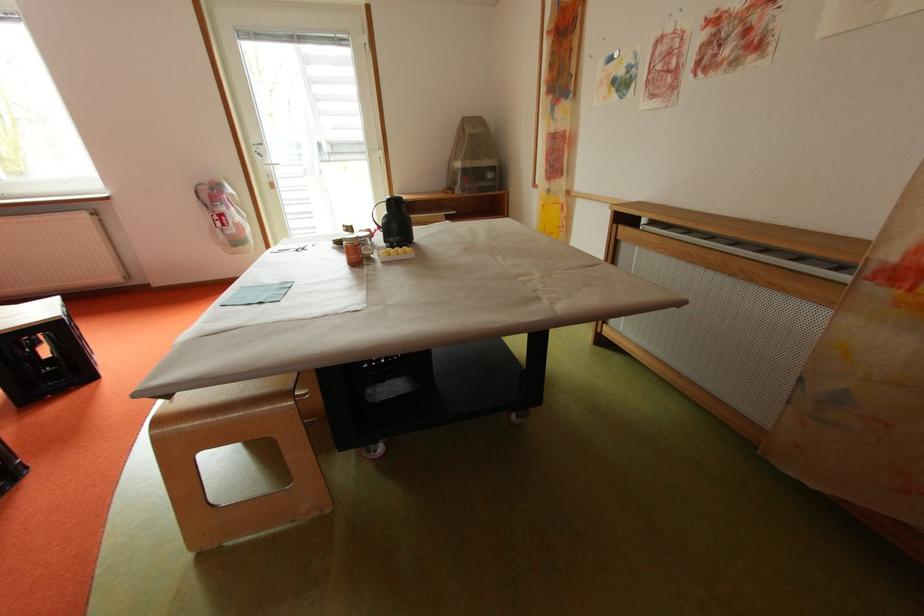
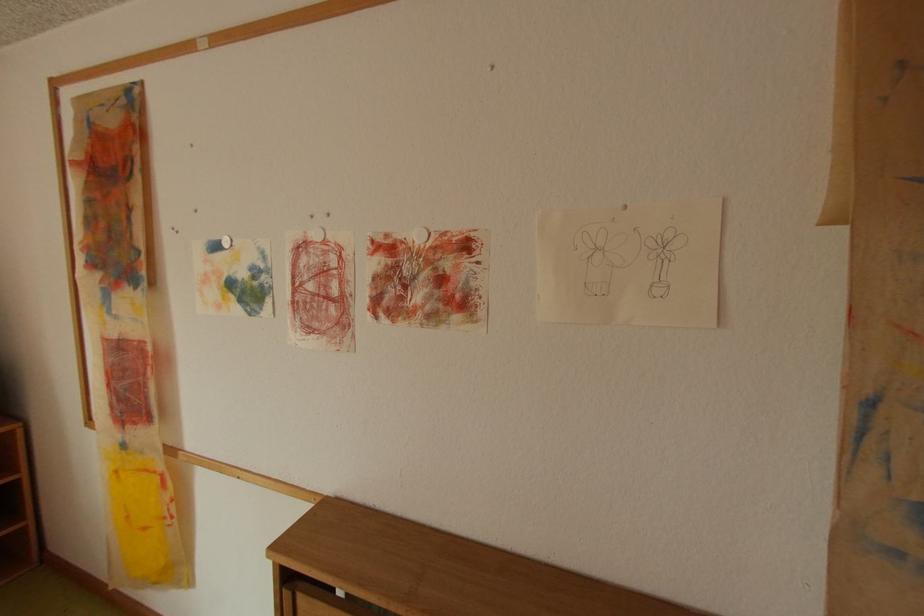
Find the pixel in the second image that matches the point at 728,65 in the first image.

(420, 313)